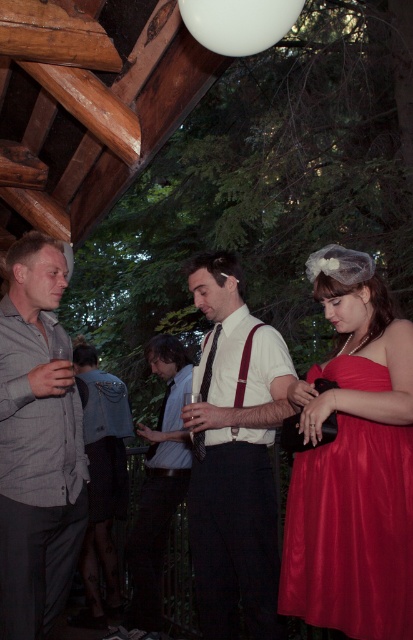
Can you confirm if white matte shirt at center is wider than denim jacket at center?

Incorrect, white matte shirt at center's width does not surpass denim jacket at center's.

Which of these two, white matte shirt at center or denim jacket at center, stands taller?

Standing taller between the two is denim jacket at center.

Where is `white matte shirt at center`? white matte shirt at center is located at coordinates (234, 456).

Is gray textured shirt at center taller than denim jacket at center?

In fact, gray textured shirt at center may be shorter than denim jacket at center.

Which is more to the left, gray textured shirt at center or denim jacket at center?

Positioned to the left is denim jacket at center.

Image resolution: width=413 pixels, height=640 pixels. Find the location of `gray textured shirt at center`. gray textured shirt at center is located at coordinates (37, 445).

Can you confirm if white matte shirt at center is positioned above gray textured shirt at center?

No.

Between point (227, 468) and point (18, 493), which one is positioned in front?

Positioned in front is point (18, 493).

At what (x,y) coordinates should I click in order to perform the action: click on white matte shirt at center. Please return your answer as a coordinate pair (x, y). The height and width of the screenshot is (640, 413). Looking at the image, I should click on (234, 456).

Find the location of a particular element. white matte shirt at center is located at coordinates (234, 456).